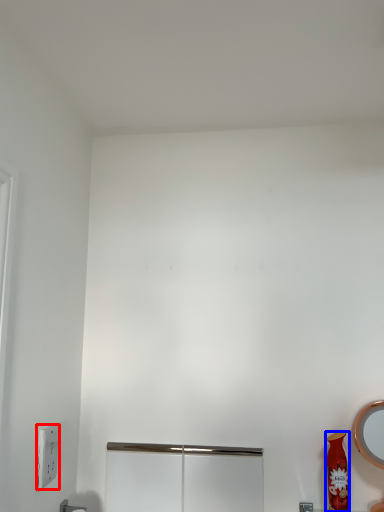
Question: Which object appears farthest to the camera in this image, light switch (highlighted by a red box) or vase (highlighted by a blue box)?

Choices:
 (A) light switch
 (B) vase

Answer: (B)